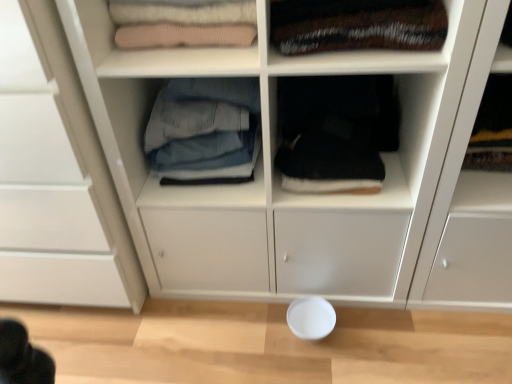
Question: In terms of height, does velvet-like brown blanket at upper right, the first clothing in the right-to-left sequence, look taller or shorter compared to white matte bowl at lower center?

Choices:
 (A) short
 (B) tall

Answer: (B)

Question: Visually, is velvet-like brown blanket at upper right, the first clothing in the right-to-left sequence, positioned to the left or to the right of white matte bowl at lower center?

Choices:
 (A) right
 (B) left

Answer: (A)

Question: Estimate the real-world distances between objects in this image. Which object is farther from the black fabric at center, the 1th shelf from the bottom?

Choices:
 (A) white matte bowl at lower center
 (B) knit fabric sweater at upper left, placed as the 1th shelf when sorted from top to bottom
 (C) velvet-like brown blanket at upper right, the first clothing in the right-to-left sequence
 (D) white matte cabinet at upper left
 (E) denim jeans at center, the second clothing positioned from the right

Answer: (D)

Question: Based on their relative distances, which object is nearer to the white matte bowl at lower center?

Choices:
 (A) denim jeans at center, acting as the 1th clothing starting from the left
 (B) knit fabric sweater at upper left, which appears as the 1th shelf when viewed from the left
 (C) white matte cabinet at upper left
 (D) black fabric at center, which is the 1th shelf from right to left
 (E) velvet-like brown blanket at upper right, the first clothing in the right-to-left sequence

Answer: (D)